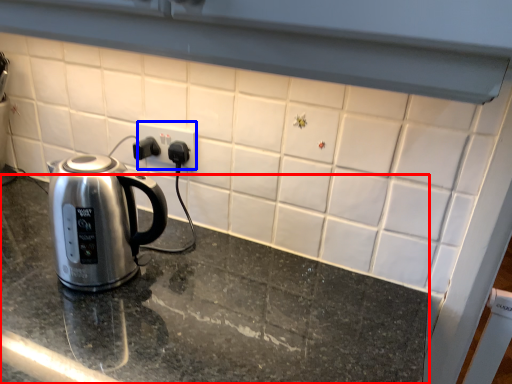
Question: Which object is further to the camera taking this photo, table top (highlighted by a red box) or electric outlet (highlighted by a blue box)?

Choices:
 (A) table top
 (B) electric outlet

Answer: (B)